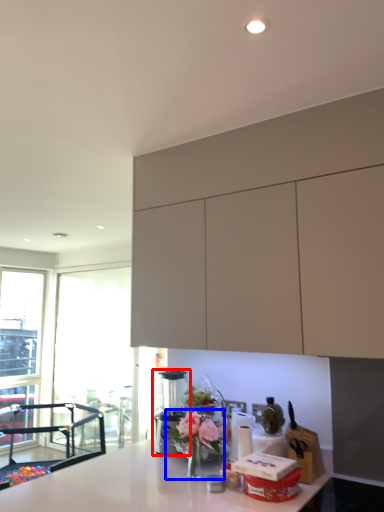
Question: Which object is closer to the camera taking this photo, coffee machine (highlighted by a red box) or floral arrangement (highlighted by a blue box)?

Choices:
 (A) coffee machine
 (B) floral arrangement

Answer: (B)